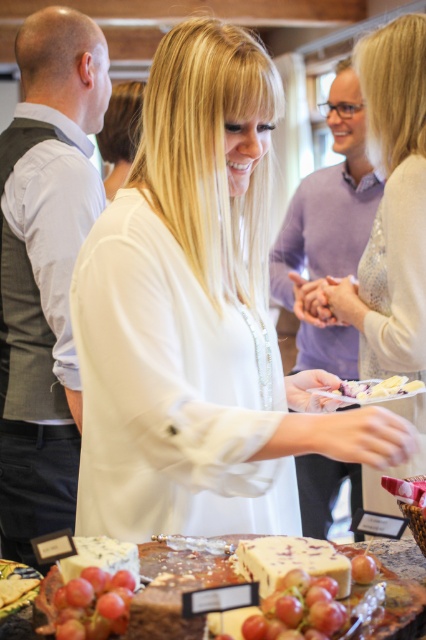
Can you confirm if smooth wooden table at center is positioned above smooth red apple at center?

No.

Is point (5, 627) less distant than point (371, 576)?

That is False.

Locate an element on the screen. smooth wooden table at center is located at coordinates (402, 557).

Can you confirm if purple glossy grapes at lower left is positioned to the right of smooth wooden table at center?

In fact, purple glossy grapes at lower left is to the left of smooth wooden table at center.

Who is more distant from viewer, (103, 598) or (414, 625)?

The point (414, 625) is more distant.

The height and width of the screenshot is (640, 426). I want to click on purple glossy grapes at lower left, so [x=94, y=604].

Between purple sweater at center and white creamy cheese at center, which one appears on the left side from the viewer's perspective?

white creamy cheese at center is more to the left.

Can you confirm if purple sweater at center is thinner than white creamy cheese at center?

In fact, purple sweater at center might be wider than white creamy cheese at center.

Who is more distant from viewer, (314, 284) or (333, 392)?

The point (314, 284) is more distant.

At what (x,y) coordinates should I click in order to perform the action: click on purple sweater at center. Please return your answer as a coordinate pair (x, y). This screenshot has width=426, height=640. Looking at the image, I should click on (328, 230).